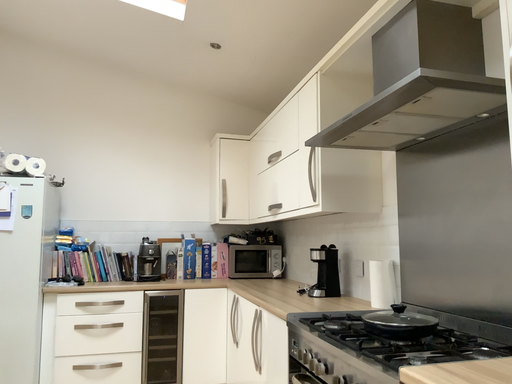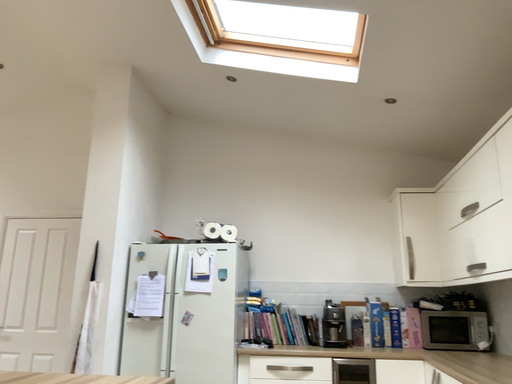
Question: How did the camera likely rotate when shooting the video?

Choices:
 (A) rotated right
 (B) rotated left

Answer: (B)